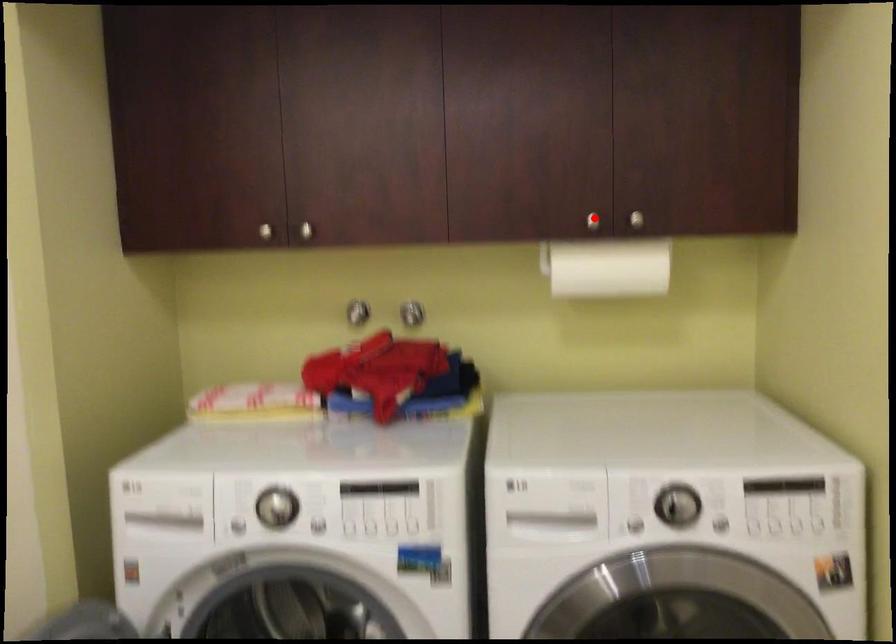
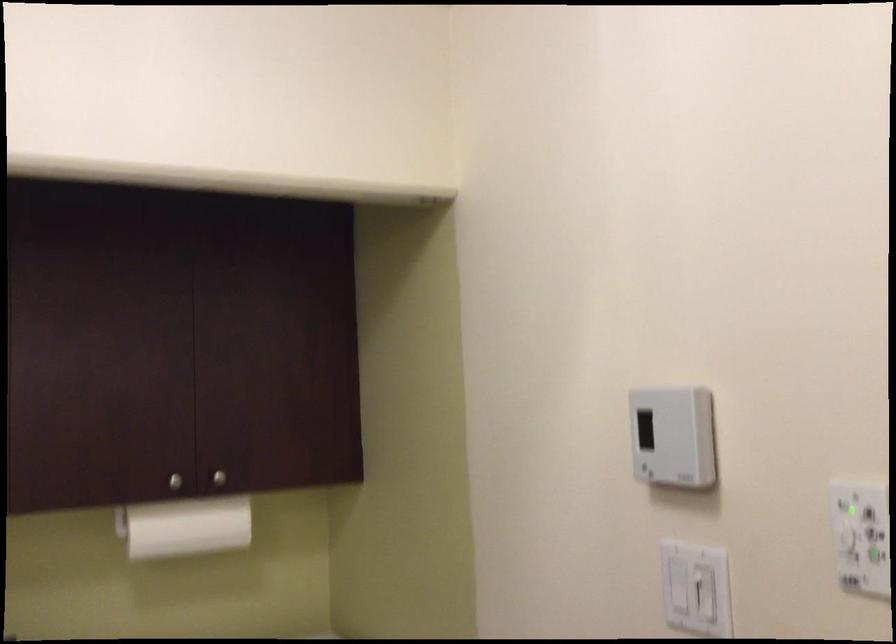
In the second image, find the point that corresponds to the highlighted location in the first image.

(175, 482)